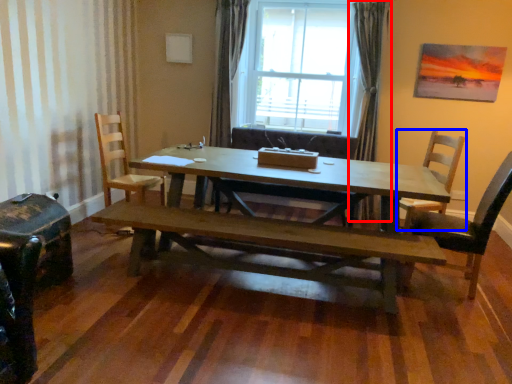
Question: Among these objects, which one is farthest to the camera, curtain (highlighted by a red box) or chair (highlighted by a blue box)?

Choices:
 (A) curtain
 (B) chair

Answer: (A)